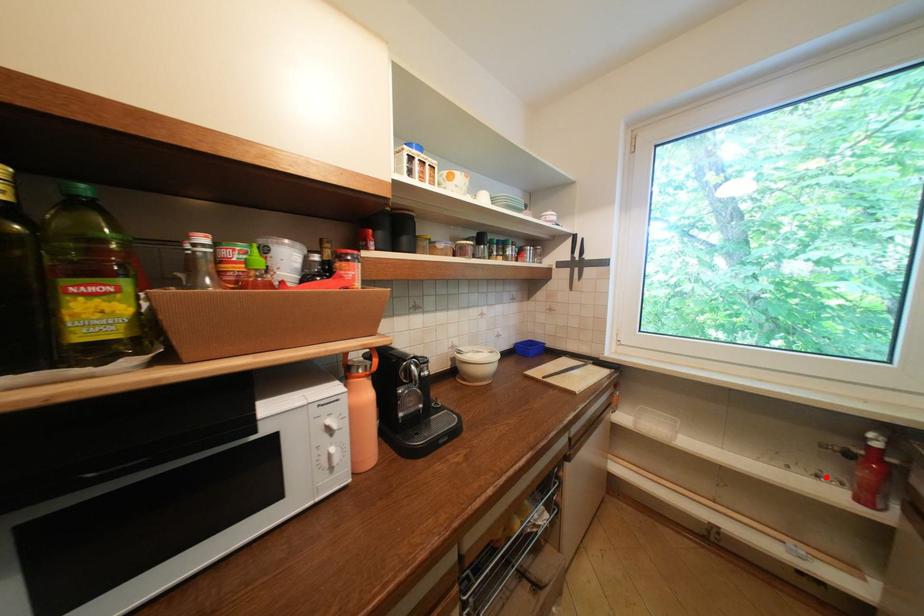
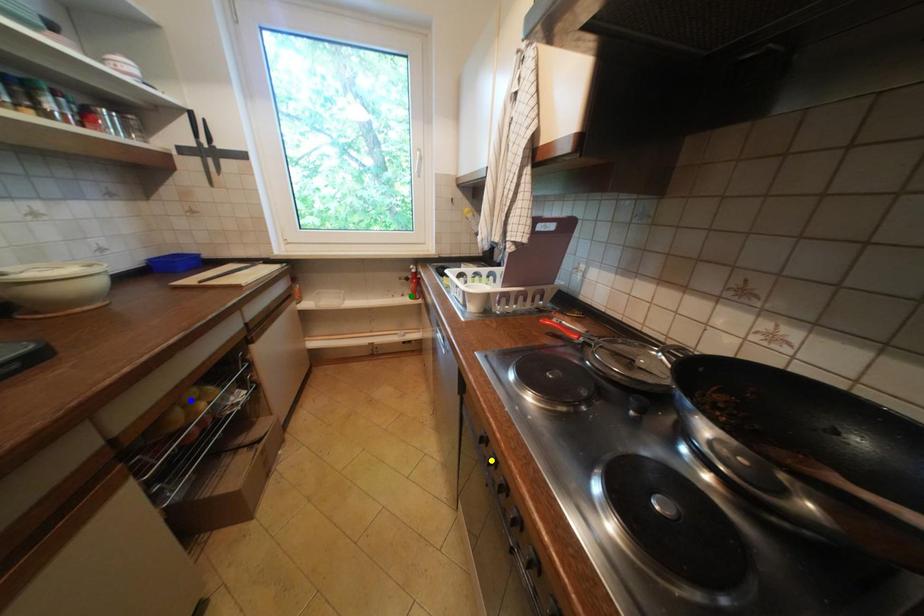
Question: I am providing you with two images of the same scene from different viewpoints. A red point is marked on the first image. You are given multiple points on the second image. Which point in image 2 is actually the same real-world point as the red point in image 1?

Choices:
 (A) yellow point
 (B) blue point
 (C) green point

Answer: (C)